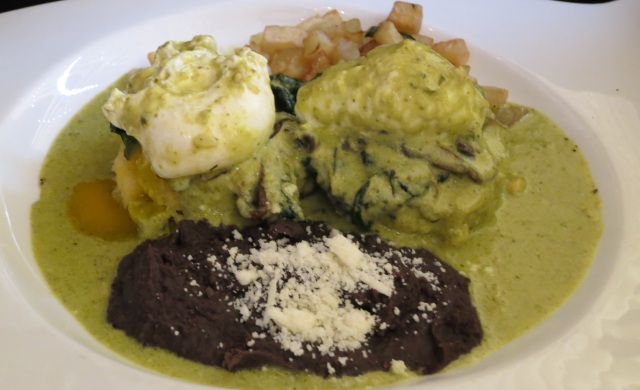
I want to click on outer edge of plate, so click(16, 10).